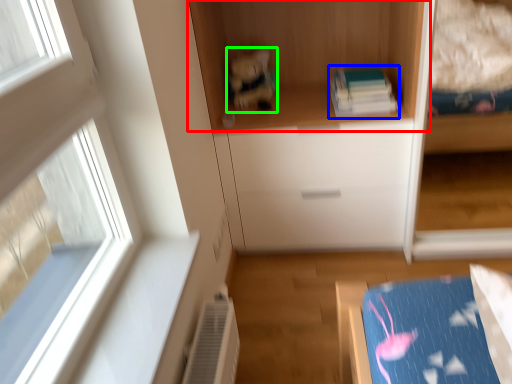
Question: Considering the real-world distances, which object is closest to cupboard (highlighted by a red box)? book (highlighted by a blue box) or toy (highlighted by a green box).

Choices:
 (A) book
 (B) toy

Answer: (B)